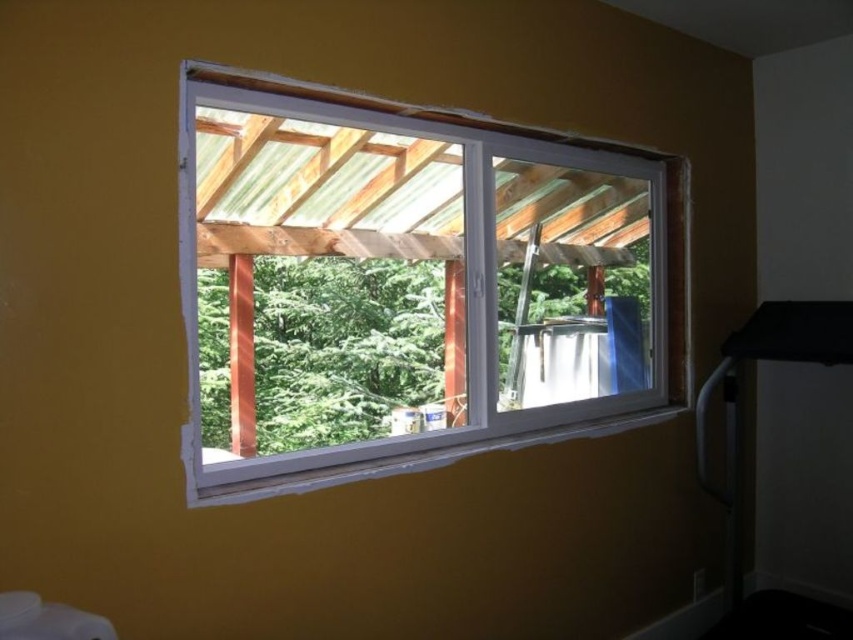
You are moving a large painting that is 60 centimeters wide. You want to hang it on the wall between the white plastic window at center and the blue fabric curtain at right. Is there enough space?

The white plastic window at center is 55.75 centimeters away from the blue fabric curtain at right. Since the painting is 60 centimeters wide, it would not fit in the available space between them.

You are standing inside the room and want to open the white plastic window at center to let in fresh air. However, there is a blue fabric curtain at right nearby. Based on their positions, which object is closer to your left side when facing the window?

The white plastic window at center is to the left of blue fabric curtain at right, so when facing the window, the white plastic window at center is closer to your left side.

You are standing in the room shown in the image. You want to know what is located exactly at the coordinates point (408, 284). What object is there?

The point (408, 284) is occupied by the white plastic window at center.